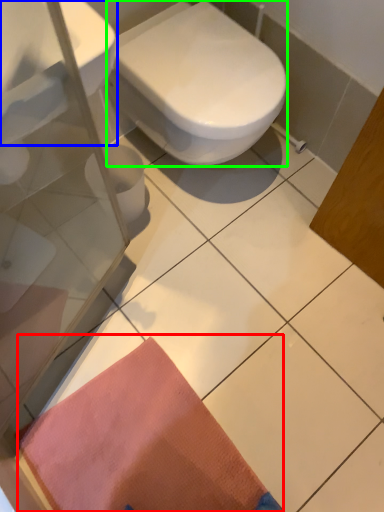
Question: Estimate the real-world distances between objects in this image. Which object is closer to doormat (highlighted by a red box), sink (highlighted by a blue box) or bidet (highlighted by a green box)?

Choices:
 (A) sink
 (B) bidet

Answer: (B)